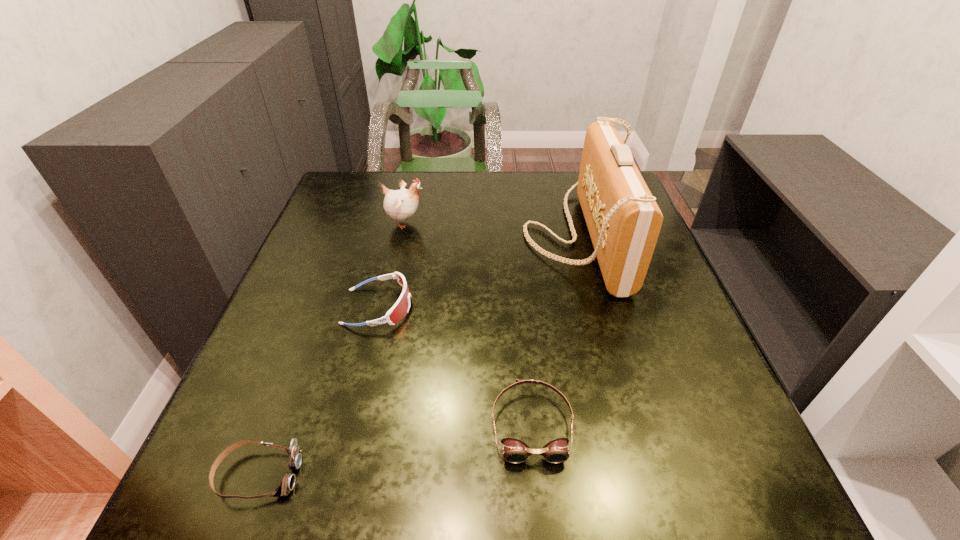
The image size is (960, 540). Find the location of `handbag present at the far edge`. handbag present at the far edge is located at coordinates (623, 219).

Identify the location of bird present at the far edge. This screenshot has height=540, width=960. click(401, 204).

Find the location of `object that is at the right edge`. object that is at the right edge is located at coordinates (623, 219).

The height and width of the screenshot is (540, 960). I want to click on object that is at the near left corner, so click(287, 483).

Locate an element on the screen. object that is positioned at the far right corner is located at coordinates (623, 219).

Image resolution: width=960 pixels, height=540 pixels. In order to click on free space at the far edge in this screenshot , I will do `click(560, 200)`.

Locate an element on the screen. free location at the near edge is located at coordinates (646, 497).

Identify the location of free spot at the left edge of the desktop. The image size is (960, 540). (377, 220).

In the image, there is a desktop. Identify the location of free space at the right edge. Image resolution: width=960 pixels, height=540 pixels. (710, 376).

Locate an element on the screen. Image resolution: width=960 pixels, height=540 pixels. vacant space at the far left corner is located at coordinates (345, 207).